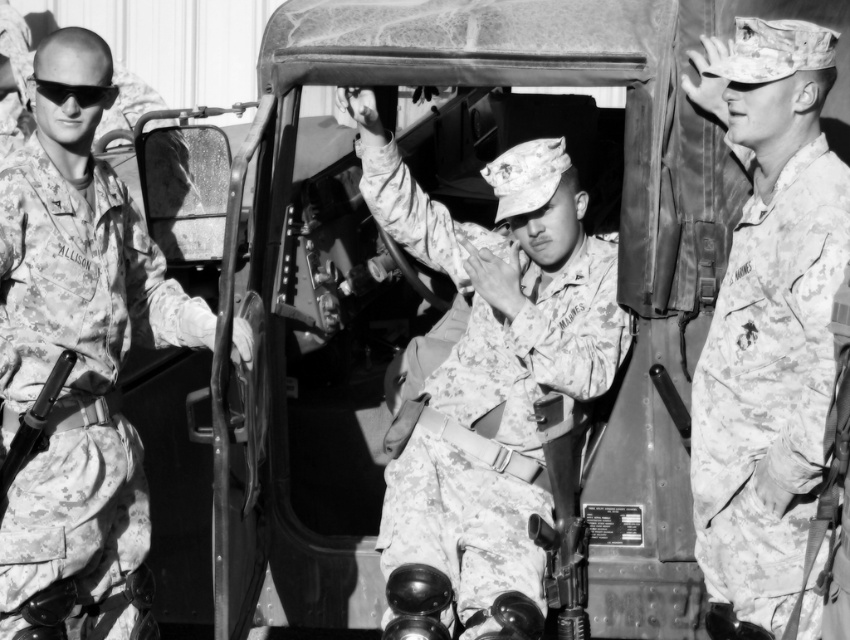
Between camouflage uniform at left and camouflage uniform at right, which one is positioned higher?

Positioned higher is camouflage uniform at right.

Which is more to the left, camouflage uniform at left or camouflage uniform at right?

camouflage uniform at left is more to the left.

Is point (83, 268) positioned in front of point (797, 429)?

No, (83, 268) is behind (797, 429).

Where is `camouflage uniform at left`? camouflage uniform at left is located at coordinates (77, 339).

Does camouflage uniform at center have a greater width compared to camouflage uniform at right?

Yes, camouflage uniform at center is wider than camouflage uniform at right.

Does camouflage uniform at center come in front of camouflage uniform at right?

No, camouflage uniform at center is further to the viewer.

Image resolution: width=850 pixels, height=640 pixels. Describe the element at coordinates (491, 360) in the screenshot. I see `camouflage uniform at center` at that location.

In order to click on camouflage uniform at center in this screenshot , I will do `click(491, 360)`.

Who is positioned more to the right, camouflage uniform at center or camouflage uniform at left?

camouflage uniform at center is more to the right.

Between camouflage uniform at center and camouflage uniform at left, which one appears on the left side from the viewer's perspective?

Positioned to the left is camouflage uniform at left.

Who is more distant from viewer, (561, 180) or (100, 445)?

Positioned behind is point (561, 180).

I want to click on camouflage uniform at center, so click(491, 360).